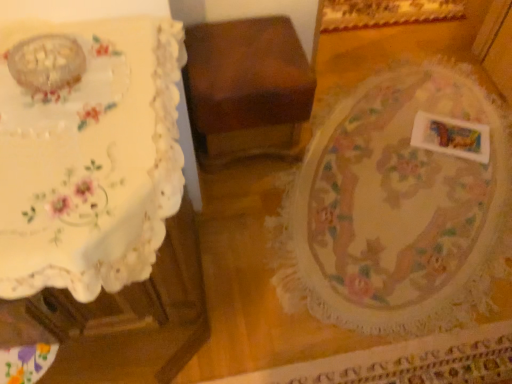
You are a GUI agent. You are given a task and a screenshot of the screen. Output one action in this format:
    pyautogui.click(x=<x>, y=<y>)
    Task: Click on the free region on the left part of white matte rectangular object at lower right
    
    Given the screenshot: What is the action you would take?
    pyautogui.click(x=387, y=144)